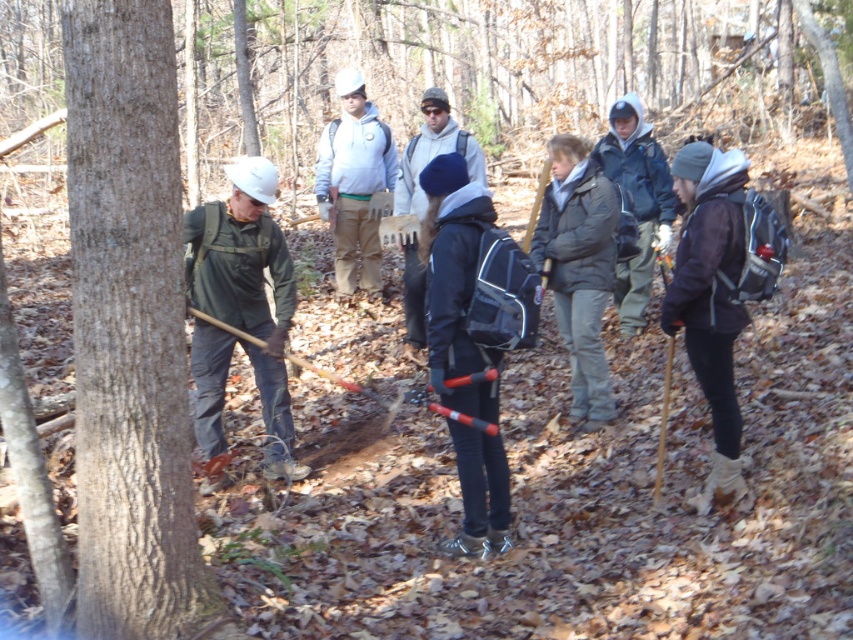
Is point (592, 321) positioned in front of point (641, 301)?

Yes, point (592, 321) is in front of point (641, 301).

What do you see at coordinates (579, 268) in the screenshot? I see `dark gray puffy jacket at center` at bounding box center [579, 268].

Describe the element at coordinates (579, 268) in the screenshot. I see `dark gray puffy jacket at center` at that location.

Find the location of a particular element. The width and height of the screenshot is (853, 640). dark gray puffy jacket at center is located at coordinates (579, 268).

This screenshot has width=853, height=640. In order to click on brown rough bark tree at left in this screenshot , I will do [131, 332].

Which is in front, point (154, 314) or point (686, 352)?

Point (154, 314) is in front.

Which is in front, point (178, 518) or point (752, 227)?

Point (178, 518) is more forward.

At what (x,y) coordinates should I click in order to perform the action: click on brown rough bark tree at left. Please return your answer as a coordinate pair (x, y). Image resolution: width=853 pixels, height=640 pixels. Looking at the image, I should click on click(131, 332).

Who is positioned more to the right, dark gray puffy jacket at center or white matte hard hat at center?

From the viewer's perspective, dark gray puffy jacket at center appears more on the right side.

Find the location of `dark gray puffy jacket at center`. dark gray puffy jacket at center is located at coordinates (579, 268).